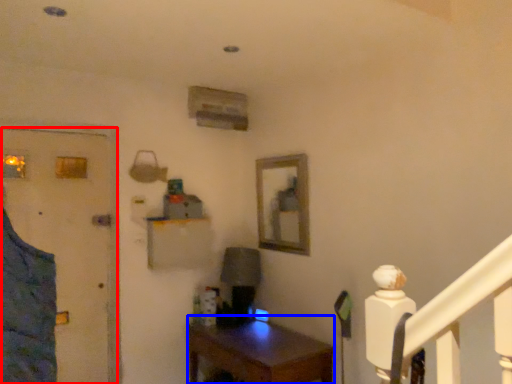
Question: Which point is closer to the camera, door (highlighted by a red box) or desk (highlighted by a blue box)?

Choices:
 (A) door
 (B) desk

Answer: (B)